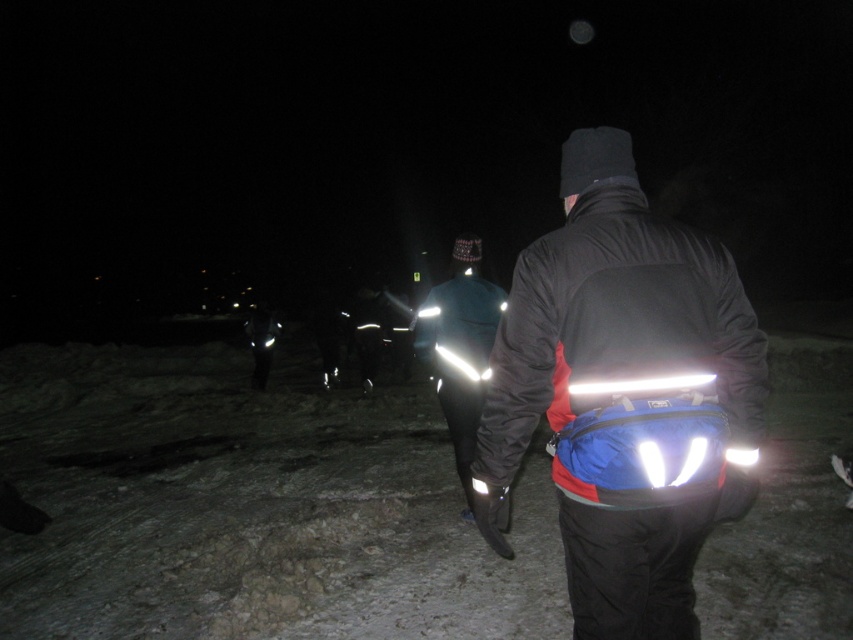
Question: Which point appears closest to the camera in this image?

Choices:
 (A) (479, 275)
 (B) (469, 333)
 (C) (436, 570)

Answer: (C)

Question: Among these points, which one is nearest to the camera?

Choices:
 (A) (20, 432)
 (B) (474, 381)
 (C) (469, 272)

Answer: (B)

Question: Estimate the real-world distances between objects in this image. Which object is closer to the glossy reflective jacket at center?

Choices:
 (A) black matte jacket at center
 (B) white matte snow at center
 (C) reflective fabric jacket at center

Answer: (C)

Question: Does reflective fabric jacket at center appear under glossy reflective jacket at center?

Choices:
 (A) yes
 (B) no

Answer: (A)

Question: From the image, what is the correct spatial relationship of white matte snow at center in relation to black matte jacket at center?

Choices:
 (A) below
 (B) above

Answer: (A)

Question: Does black matte jacket at center come behind glossy reflective jacket at center?

Choices:
 (A) no
 (B) yes

Answer: (A)